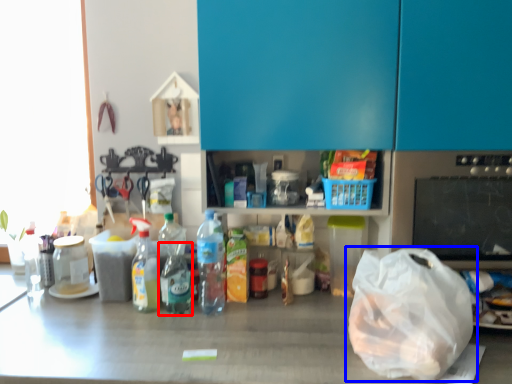
Question: Among these objects, which one is nearest to the camera, bottle (highlighted by a red box) or plastic bag (highlighted by a blue box)?

Choices:
 (A) bottle
 (B) plastic bag

Answer: (B)